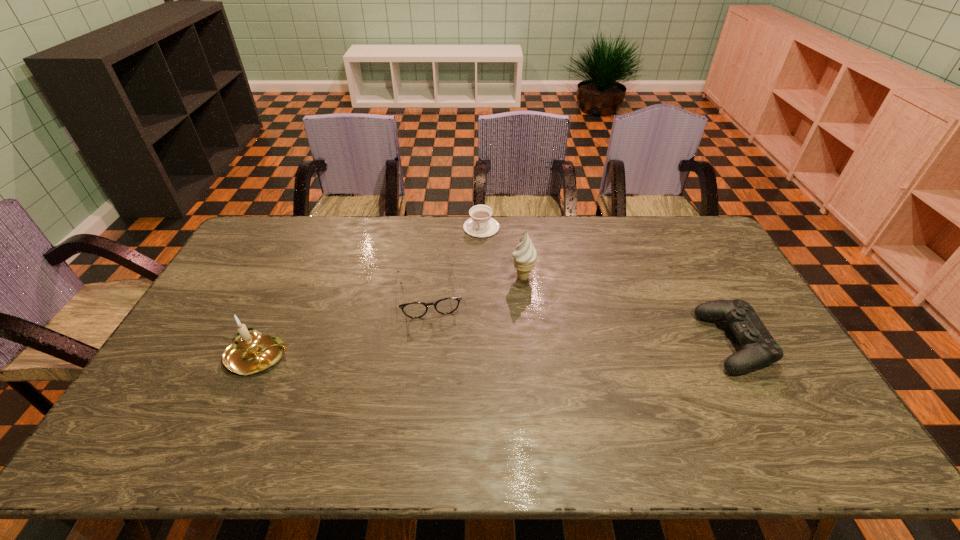
The image size is (960, 540). Identify the location of free space between the rightmost object and the farthest object. (608, 285).

Where is `free space between the farthest object and the spectacles`? free space between the farthest object and the spectacles is located at coordinates 455,260.

The image size is (960, 540). I want to click on vacant space that is in between the spectacles and the teacup, so click(455, 260).

What are the coordinates of `free space that is in between the spectacles and the second object from right to left` in the screenshot? It's located at (475, 285).

Where is `free area in between the spectacles and the fourth shortest object`? free area in between the spectacles and the fourth shortest object is located at coordinates (345, 325).

Identify the location of free space between the fourth object from left to right and the farthest object. (502, 252).

This screenshot has height=540, width=960. What are the coordinates of `empty location between the fourth shortest object and the third tallest object` in the screenshot? It's located at (497, 350).

You are a GUI agent. You are given a task and a screenshot of the screen. Output one action in this format:
    pyautogui.click(x=<x>, y=<y>)
    Task: Click on the object that can be found as the third closest to the second object from right to left
    The height and width of the screenshot is (540, 960).
    Given the screenshot: What is the action you would take?
    pyautogui.click(x=759, y=349)

The image size is (960, 540). In order to click on object that stands as the second closest to the spectacles in this screenshot , I will do `click(481, 225)`.

What are the coordinates of `free spot that satisfies the following two spatial constraints: 1. on the front side of the fourth object from left to right; 2. on the left side of the farthest object` in the screenshot? It's located at (482, 277).